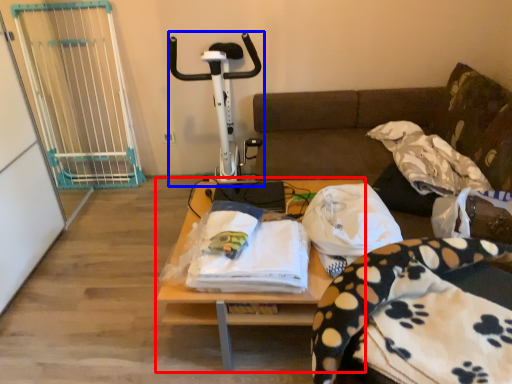
Question: Which object appears farthest to the camera in this image, table (highlighted by a red box) or sport equipment (highlighted by a blue box)?

Choices:
 (A) table
 (B) sport equipment

Answer: (B)